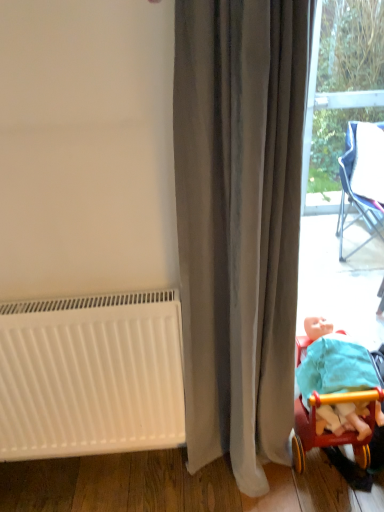
Describe the element at coordinates (330, 431) in the screenshot. I see `wooden toy carriage at lower right` at that location.

The image size is (384, 512). Describe the element at coordinates (239, 224) in the screenshot. I see `gray velvet curtain at center` at that location.

Where is `wooden toy carriage at lower right`? wooden toy carriage at lower right is located at coordinates (330, 431).

Consider the image. From the image's perspective, who appears lower, wooden toy carriage at lower right or gray velvet curtain at center?

From the image's view, wooden toy carriage at lower right is below.

Is gray velvet curtain at center located within wooden toy carriage at lower right?

Definitely not — gray velvet curtain at center is not inside wooden toy carriage at lower right.

From a real-world perspective, is wooden toy carriage at lower right above or below gray velvet curtain at center?

wooden toy carriage at lower right is situated lower than gray velvet curtain at center in the real world.

How far apart are wooden toy carriage at lower right and white matte radiator at lower left?

The distance of wooden toy carriage at lower right from white matte radiator at lower left is 23.58 inches.

Is wooden toy carriage at lower right far from white matte radiator at lower left?

They are positioned close to each other.

The height and width of the screenshot is (512, 384). What are the coordinates of `radiator on the left of wooden toy carriage at lower right` in the screenshot? It's located at [91, 375].

Which object is positioned more to the right, wooden toy carriage at lower right or white matte radiator at lower left?

wooden toy carriage at lower right.

What's the angular difference between gray velvet curtain at center and white matte radiator at lower left's facing directions?

The angular difference between gray velvet curtain at center and white matte radiator at lower left is 0.0729 degrees.

Is gray velvet curtain at center far away from white matte radiator at lower left?

No.

This screenshot has height=512, width=384. Find the location of `radiator behind the gray velvet curtain at center`. radiator behind the gray velvet curtain at center is located at coordinates (91, 375).

From the image's perspective, is gray velvet curtain at center positioned above or below wooden toy carriage at lower right?

gray velvet curtain at center is situated higher than wooden toy carriage at lower right in the image.

Looking at this image, between gray velvet curtain at center and wooden toy carriage at lower right, which one has smaller width?

gray velvet curtain at center.

Would you say gray velvet curtain at center is to the left or to the right of wooden toy carriage at lower right in the picture?

From the image, it's evident that gray velvet curtain at center is to the left of wooden toy carriage at lower right.

From the image's perspective, who appears lower, white matte radiator at lower left or gray velvet curtain at center?

white matte radiator at lower left is shown below in the image.

Would you say gray velvet curtain at center is part of white matte radiator at lower left's contents?

Actually, gray velvet curtain at center is outside white matte radiator at lower left.

Consider the image. Which is more to the right, white matte radiator at lower left or gray velvet curtain at center?

Positioned to the right is gray velvet curtain at center.

Locate an element on the screen. This screenshot has height=512, width=384. furniture beneath the white matte radiator at lower left (from a real-world perspective) is located at coordinates (330, 431).

In the image, is white matte radiator at lower left positioned in front of or behind wooden toy carriage at lower right?

white matte radiator at lower left is positioned closer to the viewer than wooden toy carriage at lower right.

Does white matte radiator at lower left have a greater height compared to wooden toy carriage at lower right?

Correct, white matte radiator at lower left is much taller as wooden toy carriage at lower right.

From the image's perspective, is white matte radiator at lower left over wooden toy carriage at lower right?

Yes.

The width and height of the screenshot is (384, 512). In order to click on curtain located above the wooden toy carriage at lower right (from a real-world perspective) in this screenshot , I will do `click(239, 224)`.

The height and width of the screenshot is (512, 384). I want to click on furniture behind the white matte radiator at lower left, so click(330, 431).

Which object lies nearer to the anchor point gray velvet curtain at center, white matte radiator at lower left or wooden toy carriage at lower right?

white matte radiator at lower left lies closer to gray velvet curtain at center than the other object.

When comparing their distances from white matte radiator at lower left, does wooden toy carriage at lower right or gray velvet curtain at center seem closer?

The object closer to white matte radiator at lower left is gray velvet curtain at center.

Looking at the image, which one is located closer to wooden toy carriage at lower right, white matte radiator at lower left or gray velvet curtain at center?

gray velvet curtain at center lies closer to wooden toy carriage at lower right than the other object.

From the picture: Based on their spatial positions, is gray velvet curtain at center or white matte radiator at lower left further from wooden toy carriage at lower right?

Among the two, white matte radiator at lower left is located further to wooden toy carriage at lower right.

From the image, which object appears to be nearer to gray velvet curtain at center, wooden toy carriage at lower right or white matte radiator at lower left?

Based on the image, white matte radiator at lower left appears to be nearer to gray velvet curtain at center.

From the image, which object appears to be farther from white matte radiator at lower left, gray velvet curtain at center or wooden toy carriage at lower right?

wooden toy carriage at lower right is further to white matte radiator at lower left.

Where is `curtain located between white matte radiator at lower left and wooden toy carriage at lower right in the left-right direction`? curtain located between white matte radiator at lower left and wooden toy carriage at lower right in the left-right direction is located at coordinates point(239,224).